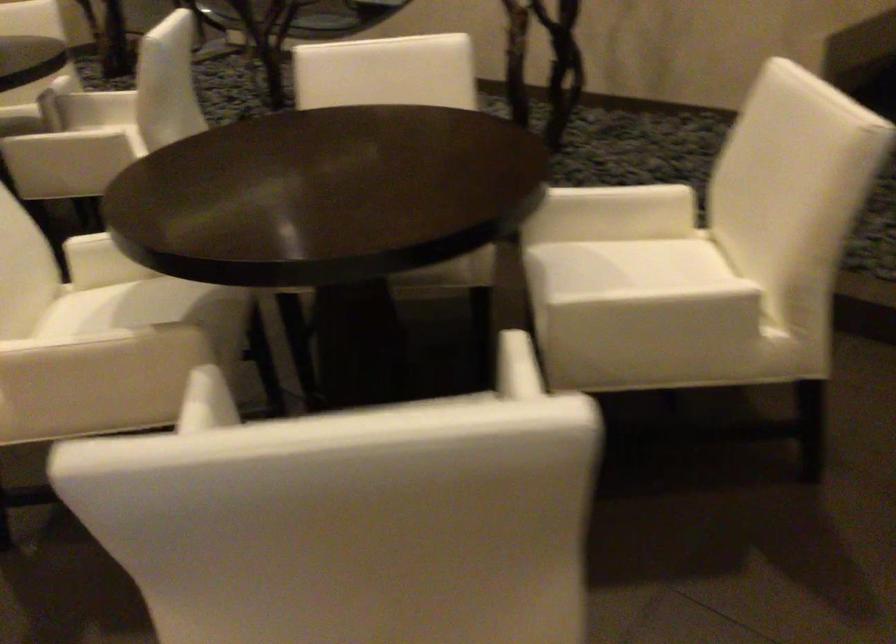
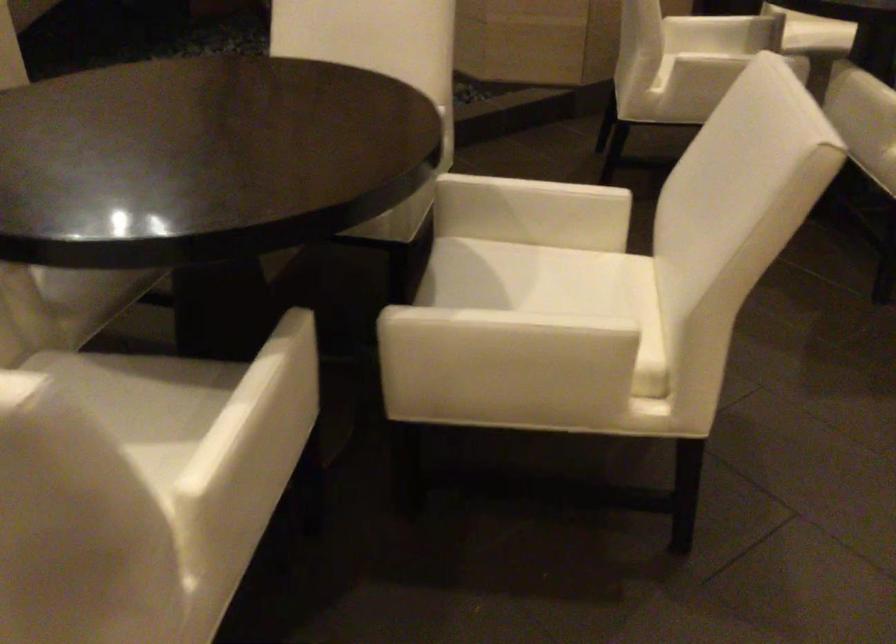
Locate, in the second image, the point that corresponds to pixel 161 321 in the first image.

(142, 401)